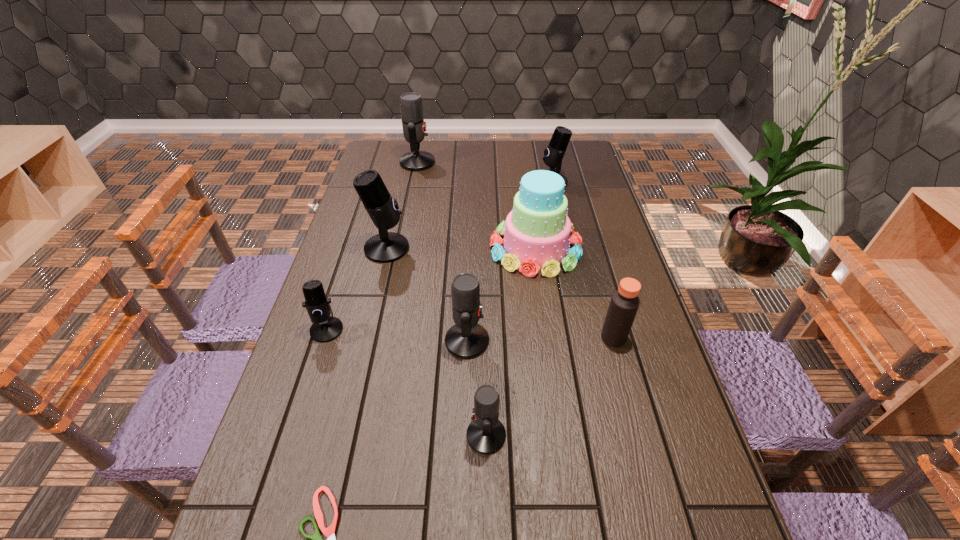
This screenshot has height=540, width=960. In order to click on the nearest microphone in this screenshot , I will do `click(486, 434)`.

Identify the location of the second nearest object. The image size is (960, 540). (486, 434).

The height and width of the screenshot is (540, 960). Identify the location of free region located 0.100m on the side of the leftmost red microphone with the red ring. click(460, 163).

Find the location of a particular element. The image size is (960, 540). blank space located 0.180m on the stand of the biggest black microphone is located at coordinates (466, 248).

The width and height of the screenshot is (960, 540). I want to click on vacant space located on the front of the blue cake, so [547, 329].

This screenshot has width=960, height=540. Find the location of `free point located 0.280m on the stand of the second farthest microphone`. free point located 0.280m on the stand of the second farthest microphone is located at coordinates (465, 182).

Where is `vacant space positioned on the stand of the second farthest microphone`? vacant space positioned on the stand of the second farthest microphone is located at coordinates (459, 182).

You are a GUI agent. You are given a task and a screenshot of the screen. Output one action in this format:
    pyautogui.click(x=<x>, y=<y>)
    Task: Click on the vacant space located on the stand of the second farthest microphone
    This screenshot has height=540, width=960.
    Given the screenshot: What is the action you would take?
    pyautogui.click(x=491, y=182)

You are a GUI agent. You are given a task and a screenshot of the screen. Output one action in this format:
    pyautogui.click(x=<x>, y=<y>)
    Task: Click on the vacant area located on the side of the second farthest red microphone with the red ring
    The width and height of the screenshot is (960, 540).
    Given the screenshot: What is the action you would take?
    pyautogui.click(x=570, y=341)

Where is `blank space located on the front of the brown vinegar`? The width and height of the screenshot is (960, 540). blank space located on the front of the brown vinegar is located at coordinates (660, 508).